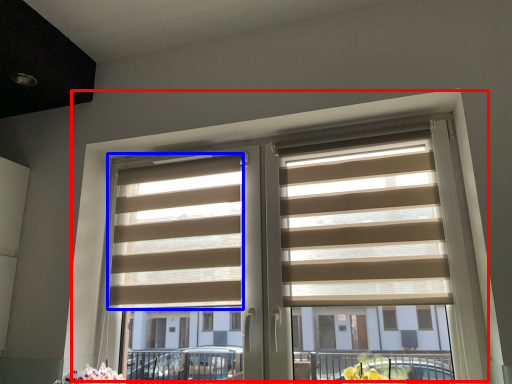
Question: Which object is further to the camera taking this photo, window (highlighted by a red box) or blind (highlighted by a blue box)?

Choices:
 (A) window
 (B) blind

Answer: (B)